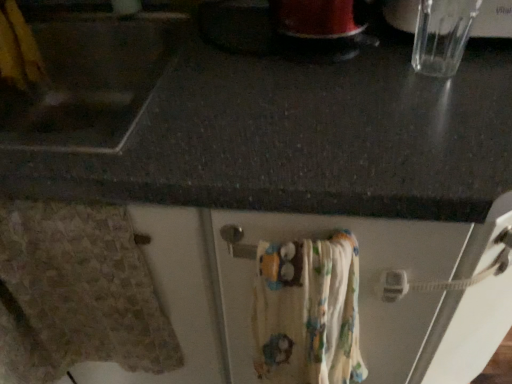
Question: Is beige textured towel at lower left, the second bath towel in the right-to-left sequence, to the left of printed cotton bath towel at lower center, placed as the 1th bath towel when sorted from right to left, from the viewer's perspective?

Choices:
 (A) yes
 (B) no

Answer: (A)

Question: Does beige textured towel at lower left, the 1th bath towel positioned from the left, have a greater height compared to printed cotton bath towel at lower center, placed as the 1th bath towel when sorted from right to left?

Choices:
 (A) no
 (B) yes

Answer: (B)

Question: Is beige textured towel at lower left, the second bath towel in the right-to-left sequence, placed right next to printed cotton bath towel at lower center, placed as the 1th bath towel when sorted from right to left?

Choices:
 (A) no
 (B) yes

Answer: (A)

Question: Does beige textured towel at lower left, the second bath towel in the right-to-left sequence, have a larger size compared to printed cotton bath towel at lower center, placed as the 1th bath towel when sorted from right to left?

Choices:
 (A) no
 (B) yes

Answer: (A)

Question: Is beige textured towel at lower left, the 1th bath towel positioned from the left, far from printed cotton bath towel at lower center, the second bath towel positioned from the left?

Choices:
 (A) yes
 (B) no

Answer: (B)

Question: From the image's perspective, is beige textured towel at lower left, the 1th bath towel positioned from the left, under printed cotton bath towel at lower center, the second bath towel positioned from the left?

Choices:
 (A) no
 (B) yes

Answer: (A)

Question: Is printed cotton bath towel at lower center, the second bath towel positioned from the left, positioned before beige textured towel at lower left, the 1th bath towel positioned from the left?

Choices:
 (A) yes
 (B) no

Answer: (A)

Question: Is printed cotton bath towel at lower center, placed as the 1th bath towel when sorted from right to left, outside beige textured towel at lower left, the 1th bath towel positioned from the left?

Choices:
 (A) yes
 (B) no

Answer: (A)

Question: From the image's perspective, is printed cotton bath towel at lower center, the second bath towel positioned from the left, beneath beige textured towel at lower left, the second bath towel in the right-to-left sequence?

Choices:
 (A) yes
 (B) no

Answer: (A)

Question: Is printed cotton bath towel at lower center, the second bath towel positioned from the left, taller than beige textured towel at lower left, the second bath towel in the right-to-left sequence?

Choices:
 (A) no
 (B) yes

Answer: (A)

Question: Does printed cotton bath towel at lower center, the second bath towel positioned from the left, have a greater width compared to beige textured towel at lower left, the second bath towel in the right-to-left sequence?

Choices:
 (A) yes
 (B) no

Answer: (A)

Question: From the image's perspective, is printed cotton bath towel at lower center, the second bath towel positioned from the left, located above beige textured towel at lower left, the second bath towel in the right-to-left sequence?

Choices:
 (A) no
 (B) yes

Answer: (A)

Question: Is beige textured towel at lower left, the 1th bath towel positioned from the left, inside the boundaries of printed cotton bath towel at lower center, the second bath towel positioned from the left, or outside?

Choices:
 (A) inside
 (B) outside

Answer: (B)